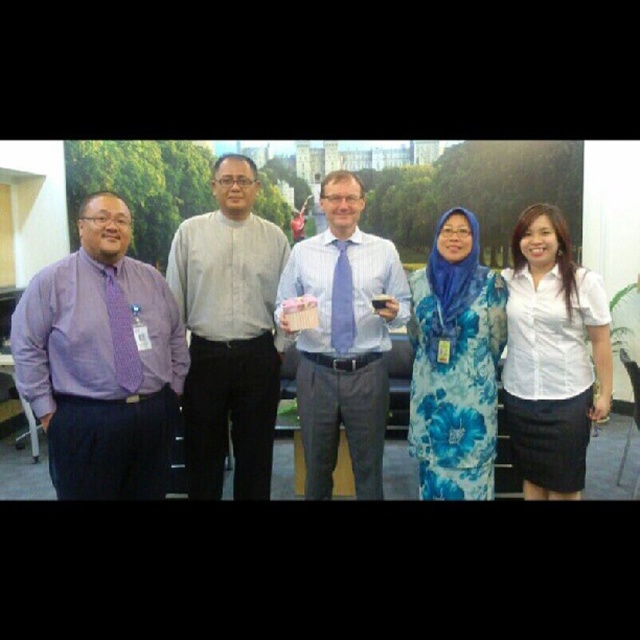
In the scene shown: Can you confirm if blue floral dress at center is thinner than purple dotted tie at left?

No, blue floral dress at center is not thinner than purple dotted tie at left.

Does point (413, 385) lie behind point (120, 324)?

Yes, point (413, 385) is behind point (120, 324).

In order to click on blue floral dress at center in this screenshot , I will do point(454,364).

Based on the photo, can you confirm if blue floral dress at center is positioned below matte blue tie at center?

Yes, blue floral dress at center is below matte blue tie at center.

Does blue floral dress at center lie behind matte blue tie at center?

No, blue floral dress at center is closer to the viewer.

What do you see at coordinates (454, 364) in the screenshot? I see `blue floral dress at center` at bounding box center [454, 364].

The width and height of the screenshot is (640, 640). What are the coordinates of `blue floral dress at center` in the screenshot? It's located at (454, 364).

Can you confirm if white matte shirt at right is bigger than purple dotted tie at left?

Yes.

This screenshot has height=640, width=640. Describe the element at coordinates (552, 356) in the screenshot. I see `white matte shirt at right` at that location.

I want to click on white matte shirt at right, so click(552, 356).